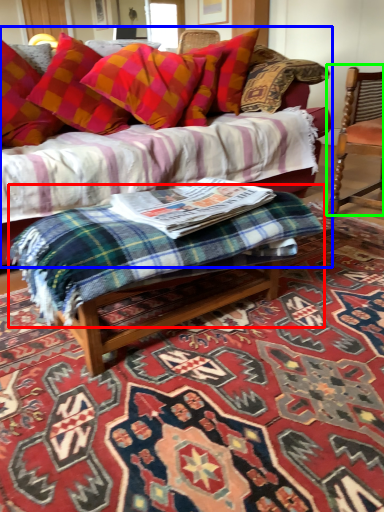
Question: Which is nearer to the bedding (highlighted by a red box)? studio couch (highlighted by a blue box) or chair (highlighted by a green box).

Choices:
 (A) studio couch
 (B) chair

Answer: (B)